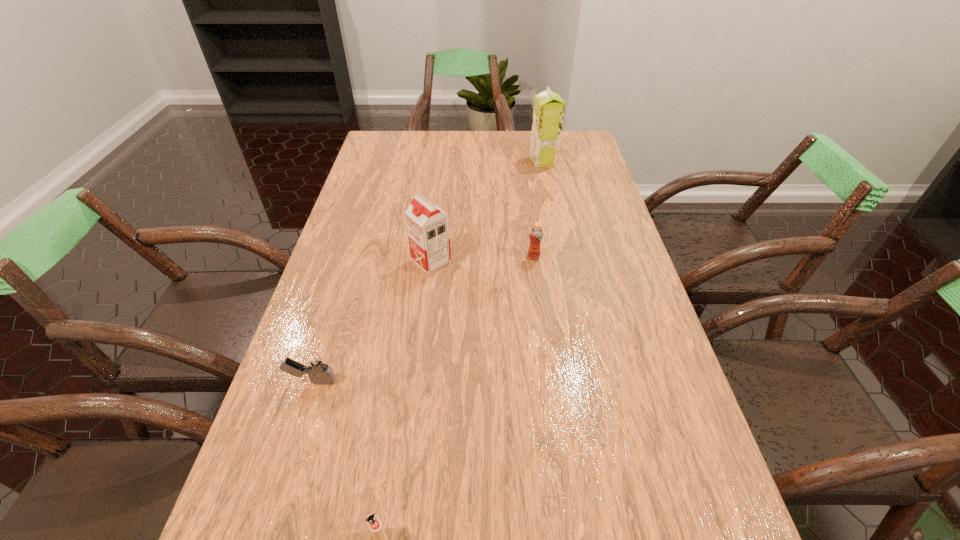
You are a GUI agent. You are given a task and a screenshot of the screen. Output one action in this format:
    pyautogui.click(x=<x>, y=<y>)
    Task: Click on the taller soya milk
    Image resolution: width=960 pixels, height=540 pixels.
    Given the screenshot: What is the action you would take?
    pyautogui.click(x=548, y=113)

The image size is (960, 540). What are the coordinates of `the farthest object` in the screenshot? It's located at (548, 113).

You are a GUI agent. You are given a task and a screenshot of the screen. Output one action in this format:
    pyautogui.click(x=<x>, y=<y>)
    Task: Click on the left soya milk
    The width and height of the screenshot is (960, 540).
    Given the screenshot: What is the action you would take?
    pyautogui.click(x=427, y=225)

The height and width of the screenshot is (540, 960). Identify the location of the shorter soya milk. (427, 225).

I want to click on orange juice, so click(x=536, y=233).

Image resolution: width=960 pixels, height=540 pixels. What are the coordinates of `the leftmost object` in the screenshot? It's located at (315, 365).

Locate an element on the screen. the left igniter is located at coordinates (315, 365).

Identify the location of vacant region located on the front of the farther soya milk. This screenshot has width=960, height=540. (550, 196).

Locate an element on the screen. blank space located 0.310m on the back of the second tallest object is located at coordinates (440, 187).

This screenshot has width=960, height=540. Identify the location of free region located 0.240m on the left of the second object from right to left. (439, 256).